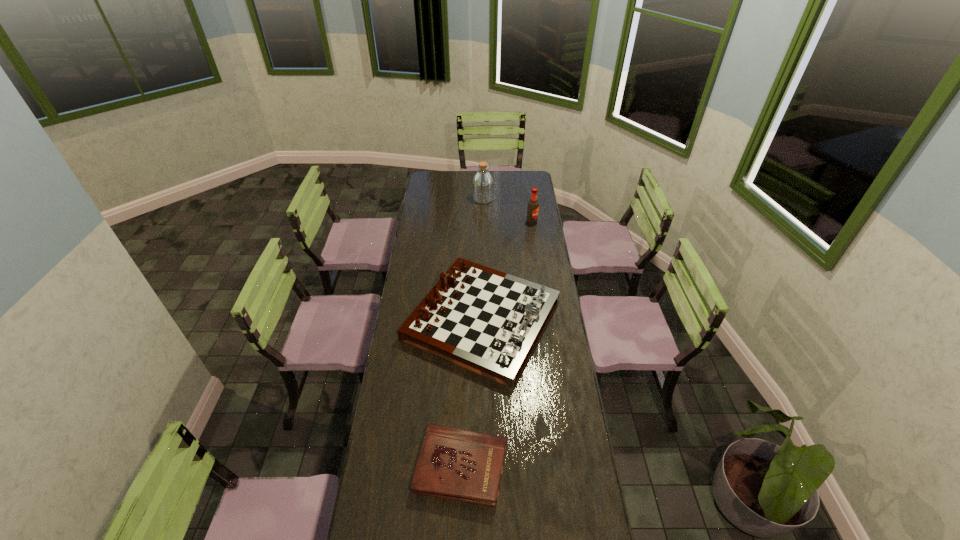
Identify the location of bottle. The width and height of the screenshot is (960, 540). (482, 184).

At what (x,y) coordinates should I click in order to perform the action: click on the third nearest object. Please return your answer as a coordinate pair (x, y). This screenshot has height=540, width=960. Looking at the image, I should click on click(x=533, y=206).

Identify the location of gameboard. (487, 321).

Identify the location of the third farthest object. (487, 321).

This screenshot has width=960, height=540. Identify the location of hardback book. (457, 464).

I want to click on the nearest object, so click(x=457, y=464).

This screenshot has height=540, width=960. Find the location of `vacant space positioned 0.280m on the front of the farthest object`. vacant space positioned 0.280m on the front of the farthest object is located at coordinates (483, 234).

Locate an element on the screen. The image size is (960, 540). vacant area situated on the back of the second farthest object is located at coordinates (527, 189).

Where is `vacant region located on the front of the third farthest object`? Image resolution: width=960 pixels, height=540 pixels. vacant region located on the front of the third farthest object is located at coordinates (483, 437).

Locate an element on the screen. Image resolution: width=960 pixels, height=540 pixels. free space located on the back of the hardback book is located at coordinates pyautogui.click(x=463, y=408).